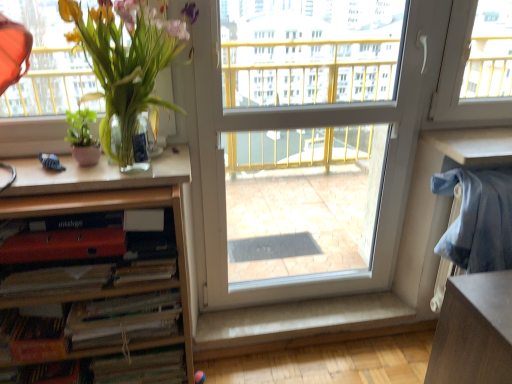
Question: From the image's perspective, is hardcover book at lower left, the first paperback book ordered from the bottom, located above or below green matte plant at left, the second houseplant viewed from the right?

Choices:
 (A) below
 (B) above

Answer: (A)

Question: Looking at the image, does hardcover book at lower left, marked as the 3th paperback book in a top-to-bottom arrangement, seem bigger or smaller compared to green matte plant at left, the second houseplant viewed from the right?

Choices:
 (A) big
 (B) small

Answer: (B)

Question: Considering the real-world distances, which object is closest to the white plastic screen door at center?

Choices:
 (A) matte red paperback book at lower left, which is the 1th paperback book in top-to-bottom order
 (B) green matte plant at left, marked as the first houseplant in a left-to-right arrangement
 (C) green glossy plant at left, the 2th houseplant viewed from the left
 (D) wooden desk at lower right
 (E) white matte paperback book at lower left, which is the second paperback book from bottom to top

Answer: (E)

Question: Which object is positioned farthest from the white plastic screen door at center?

Choices:
 (A) white matte paperback book at lower left, which is the second paperback book from bottom to top
 (B) hardcover book at lower left, the first paperback book ordered from the bottom
 (C) matte red paperback book at lower left, which is the 1th paperback book in top-to-bottom order
 (D) wooden bookshelf at left
 (E) green glossy plant at left, which is counted as the first houseplant, starting from the right

Answer: (C)